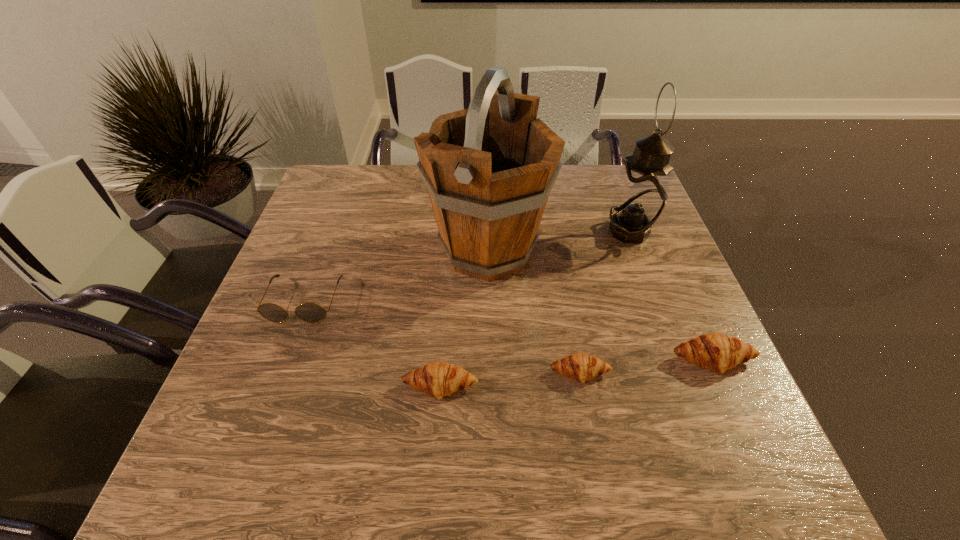
Locate an element on the screen. vacant spot to place a pastry on the left is located at coordinates (295, 401).